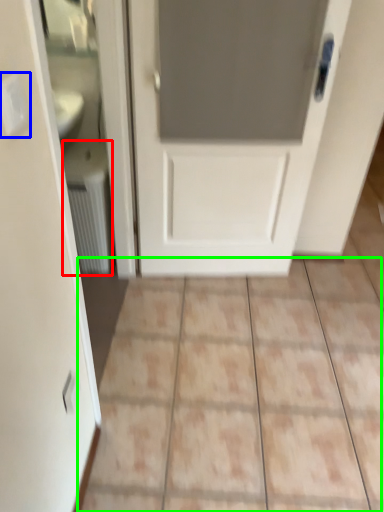
Question: Based on their relative distances, which object is farther from radiator (highlighted by a red box)? Choose from electric outlet (highlighted by a blue box) and ceramic tile (highlighted by a green box).

Choices:
 (A) electric outlet
 (B) ceramic tile

Answer: (A)